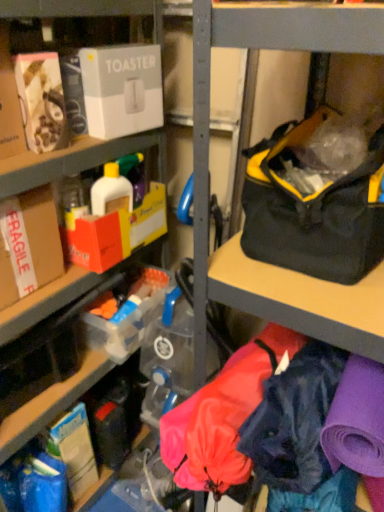
Question: From a real-world perspective, does black/yellow fabric bag at right stand above white cardboard toaster at upper left, the 1th box from the right?

Choices:
 (A) yes
 (B) no

Answer: (B)

Question: Considering the relative sizes of black/yellow fabric bag at right and white cardboard toaster at upper left, acting as the second box starting from the left, in the image provided, is black/yellow fabric bag at right shorter than white cardboard toaster at upper left, acting as the second box starting from the left,?

Choices:
 (A) yes
 (B) no

Answer: (B)

Question: From the image's perspective, is black/yellow fabric bag at right below white cardboard toaster at upper left, acting as the second box starting from the left?

Choices:
 (A) yes
 (B) no

Answer: (A)

Question: Does black/yellow fabric bag at right have a larger size compared to white cardboard toaster at upper left, the second box positioned from the bottom?

Choices:
 (A) no
 (B) yes

Answer: (B)

Question: Is black/yellow fabric bag at right not within white cardboard toaster at upper left, arranged as the first box when viewed from the top?

Choices:
 (A) no
 (B) yes

Answer: (B)

Question: Is black/yellow fabric bag at right facing away from white cardboard toaster at upper left, acting as the second box starting from the left?

Choices:
 (A) yes
 (B) no

Answer: (B)

Question: Is black/yellow fabric bag at right positioned beyond the bounds of brown cardboard box at left, which is the second box in right-to-left order?

Choices:
 (A) no
 (B) yes

Answer: (B)

Question: From a real-world perspective, is black/yellow fabric bag at right over brown cardboard box at left, positioned as the first box in bottom-to-top order?

Choices:
 (A) yes
 (B) no

Answer: (A)

Question: Is the position of black/yellow fabric bag at right more distant than that of brown cardboard box at left, which is the first box from left to right?

Choices:
 (A) no
 (B) yes

Answer: (A)

Question: Does black/yellow fabric bag at right appear on the right side of brown cardboard box at left, which is the second box in top-to-bottom order?

Choices:
 (A) yes
 (B) no

Answer: (A)

Question: Is brown cardboard box at left, which is the second box in top-to-bottom order, at the back of black/yellow fabric bag at right?

Choices:
 (A) no
 (B) yes

Answer: (A)

Question: Is black/yellow fabric bag at right not close to brown cardboard box at left, which is the second box in top-to-bottom order?

Choices:
 (A) yes
 (B) no

Answer: (B)

Question: Is white cardboard toaster at upper left, the second box positioned from the bottom, wider than black/yellow fabric bag at right?

Choices:
 (A) yes
 (B) no

Answer: (B)